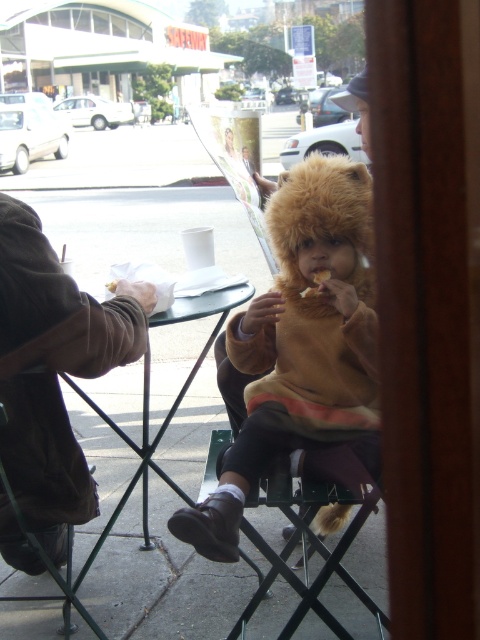
Is point (179, 301) farther from camera compared to point (309, 289)?

That is True.

Who is lower down, green plastic table at center or golden brown crumb at center?

green plastic table at center

Describe the element at coordinates (183, 381) in the screenshot. I see `green plastic table at center` at that location.

The image size is (480, 640). In order to click on green plastic table at center in this screenshot , I will do `click(183, 381)`.

Which of these two, brown leather jacket at left or metallic green stool at lower center, stands shorter?

With less height is metallic green stool at lower center.

Where is `brown leather jacket at left`? The image size is (480, 640). brown leather jacket at left is located at coordinates (51, 372).

This screenshot has height=640, width=480. I want to click on brown leather jacket at left, so click(51, 372).

Looking at this image, can you confirm if metallic green stool at lower center is smaller than golden crispy cracker at center?

No, metallic green stool at lower center is not smaller than golden crispy cracker at center.

Which is above, metallic green stool at lower center or golden crispy cracker at center?

golden crispy cracker at center is above.

Who is more distant from viewer, [216,449] or [317,282]?

Point [216,449]

This screenshot has width=480, height=640. What are the coordinates of `metallic green stool at lower center` in the screenshot? It's located at (290, 580).